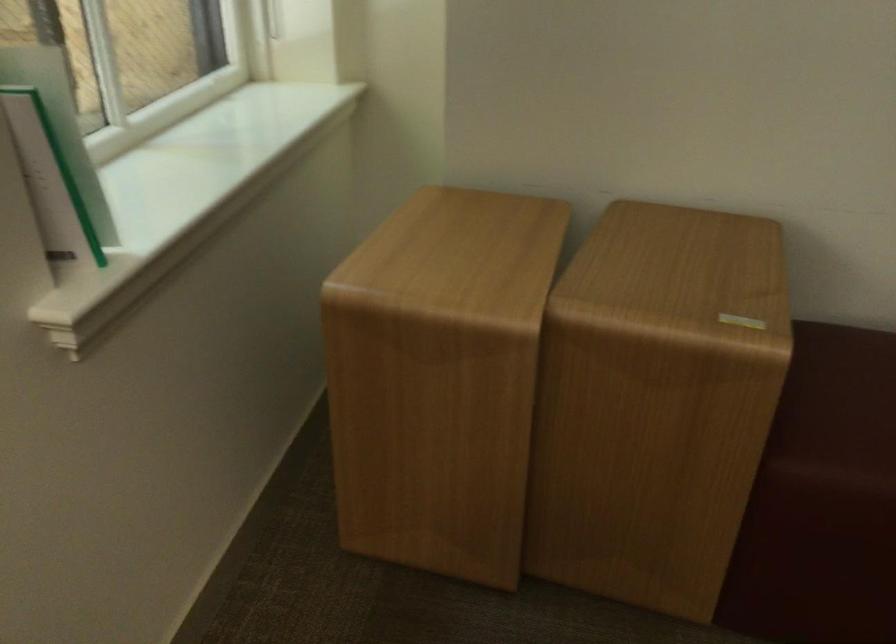
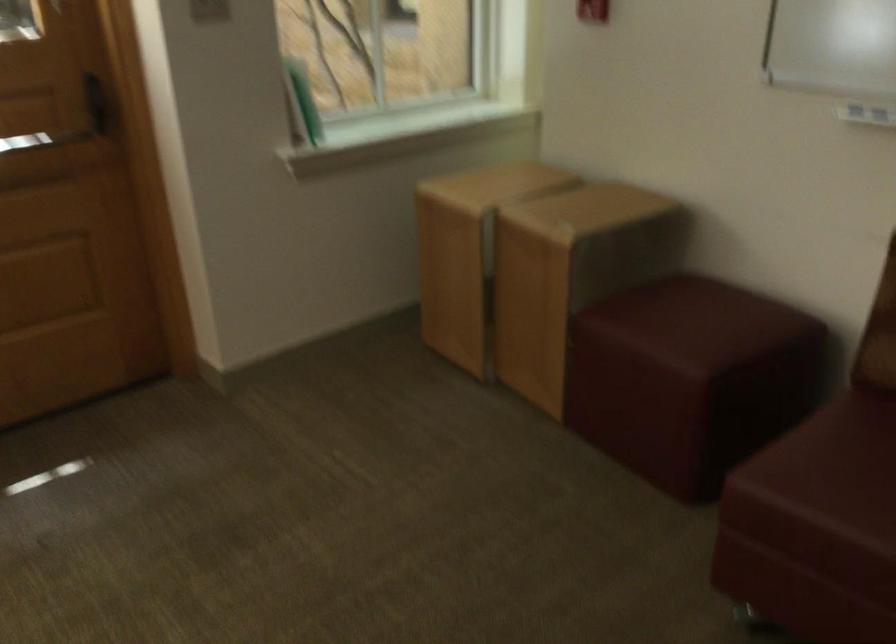
Find the pixel in the second image that matches the point at 485,395 in the first image.

(469, 252)